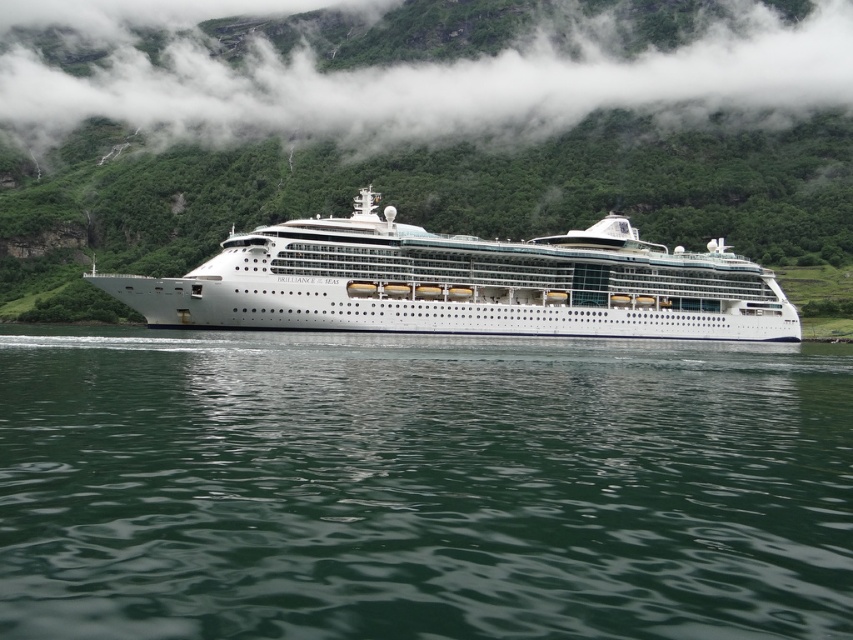
Based on the photo, is white fluffy cloud at upper center closer to the viewer compared to white glossy cruise ship at center?

No, white fluffy cloud at upper center is further to the viewer.

Does white fluffy cloud at upper center have a lesser height compared to white glossy cruise ship at center?

No.

Does point (769, 22) lie behind point (693, 333)?

Yes.

Find the location of a particular element. The image size is (853, 640). white fluffy cloud at upper center is located at coordinates (415, 77).

How distant is green liquid water at center from white fluffy cloud at upper center?

green liquid water at center and white fluffy cloud at upper center are 905.15 feet apart from each other.

In the scene shown: Does green liquid water at center have a smaller size compared to white fluffy cloud at upper center?

Yes, green liquid water at center is smaller than white fluffy cloud at upper center.

Between point (570, 442) and point (354, 100), which one is positioned in front?

Positioned in front is point (570, 442).

This screenshot has width=853, height=640. What are the coordinates of `green liquid water at center` in the screenshot? It's located at (421, 486).

Is point (608, 452) behind point (695, 275)?

That is False.

Does green liquid water at center appear over white glossy cruise ship at center?

No, green liquid water at center is not above white glossy cruise ship at center.

This screenshot has height=640, width=853. Describe the element at coordinates (421, 486) in the screenshot. I see `green liquid water at center` at that location.

The image size is (853, 640). I want to click on green liquid water at center, so click(421, 486).